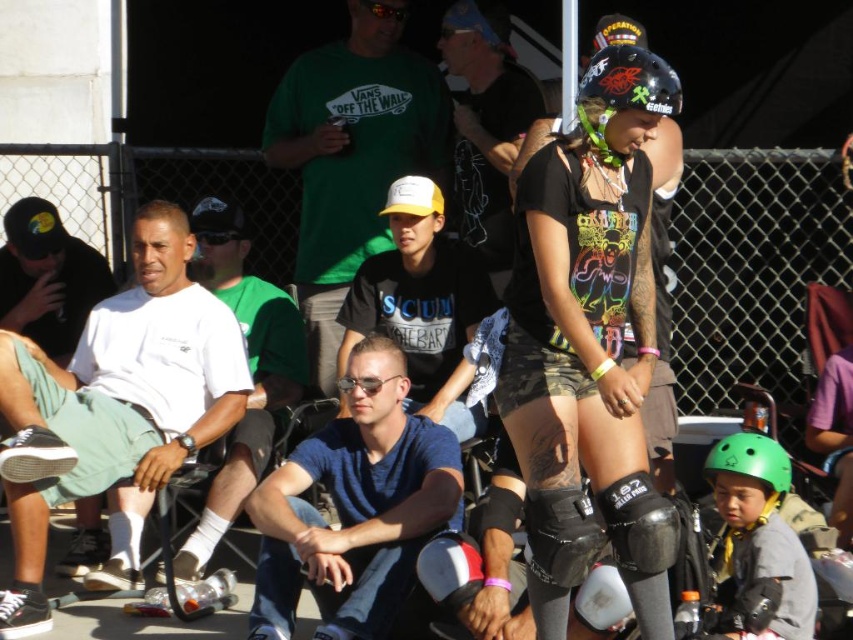
Does matte black helmet at center appear on the right side of black matte shirt at center?

Indeed, matte black helmet at center is positioned on the right side of black matte shirt at center.

The height and width of the screenshot is (640, 853). What do you see at coordinates (589, 346) in the screenshot?
I see `matte black helmet at center` at bounding box center [589, 346].

Locate an element on the screen. matte black helmet at center is located at coordinates (589, 346).

Image resolution: width=853 pixels, height=640 pixels. What are the coordinates of `matte black helmet at center` in the screenshot? It's located at (589, 346).

Is blue cotton shirt at center below green t-shirt at upper center?

Yes, blue cotton shirt at center is below green t-shirt at upper center.

Who is higher up, blue cotton shirt at center or green t-shirt at upper center?

green t-shirt at upper center is above.

This screenshot has width=853, height=640. Find the location of `blue cotton shirt at center`. blue cotton shirt at center is located at coordinates (354, 506).

The image size is (853, 640). I want to click on blue cotton shirt at center, so click(x=354, y=506).

Can you confirm if matte black helmet at center is positioned to the right of black matte knee pad at lower center?

In fact, matte black helmet at center is to the left of black matte knee pad at lower center.

You are a GUI agent. You are given a task and a screenshot of the screen. Output one action in this format:
    pyautogui.click(x=<x>, y=<y>)
    Task: Click on the matte black helmet at center
    The width and height of the screenshot is (853, 640).
    Given the screenshot: What is the action you would take?
    pyautogui.click(x=589, y=346)

Describe the element at coordinates (589, 346) in the screenshot. I see `matte black helmet at center` at that location.

Locate an element on the screen. matte black helmet at center is located at coordinates (589, 346).